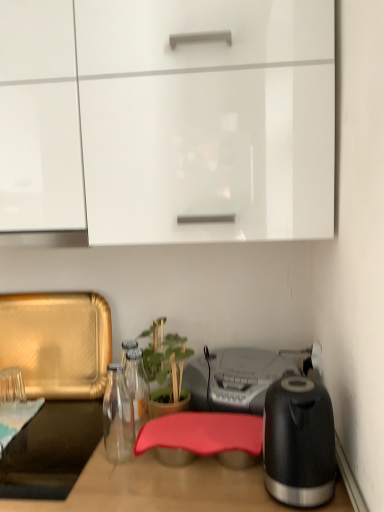
Question: Is the position of white glossy cabinet at upper center more distant than that of green matte plant at center?

Choices:
 (A) yes
 (B) no

Answer: (B)

Question: Is white glossy cabinet at upper center shorter than green matte plant at center?

Choices:
 (A) yes
 (B) no

Answer: (B)

Question: Is white glossy cabinet at upper center in front of green matte plant at center?

Choices:
 (A) yes
 (B) no

Answer: (A)

Question: Is white glossy cabinet at upper center looking in the opposite direction of green matte plant at center?

Choices:
 (A) yes
 (B) no

Answer: (B)

Question: Can you confirm if white glossy cabinet at upper center is bigger than green matte plant at center?

Choices:
 (A) yes
 (B) no

Answer: (A)

Question: Considering the positions of point (301, 364) and point (155, 331), is point (301, 364) closer or farther from the camera than point (155, 331)?

Choices:
 (A) farther
 (B) closer

Answer: (B)

Question: In terms of height, does metallic silver radio at center look taller or shorter compared to green matte plant at center?

Choices:
 (A) short
 (B) tall

Answer: (A)

Question: Is metallic silver radio at center to the left or to the right of green matte plant at center in the image?

Choices:
 (A) right
 (B) left

Answer: (A)

Question: Which is correct: metallic silver radio at center is inside green matte plant at center, or outside of it?

Choices:
 (A) outside
 (B) inside

Answer: (A)

Question: Is black glossy electric kettle at right inside or outside of metallic silver radio at center?

Choices:
 (A) outside
 (B) inside

Answer: (A)

Question: Considering their positions, is black glossy electric kettle at right located in front of or behind metallic silver radio at center?

Choices:
 (A) behind
 (B) front

Answer: (B)

Question: From a real-world perspective, relative to metallic silver radio at center, is black glossy electric kettle at right vertically above or below?

Choices:
 (A) below
 (B) above

Answer: (B)

Question: From their relative heights in the image, would you say black glossy electric kettle at right is taller or shorter than metallic silver radio at center?

Choices:
 (A) short
 (B) tall

Answer: (B)

Question: Is green matte plant at center taller or shorter than black glossy electric kettle at right?

Choices:
 (A) short
 (B) tall

Answer: (B)

Question: Looking at their shapes, would you say green matte plant at center is wider or thinner than black glossy electric kettle at right?

Choices:
 (A) wide
 (B) thin

Answer: (A)